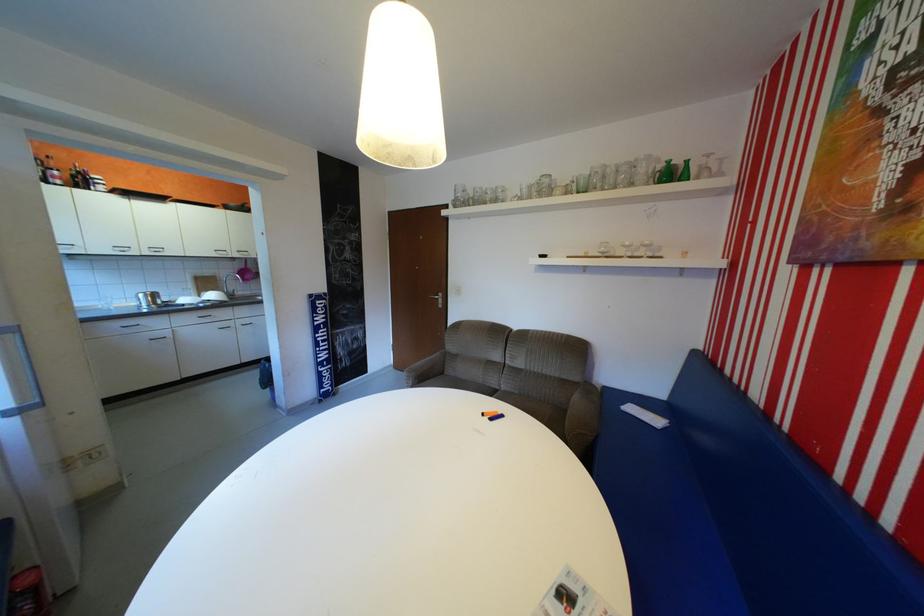
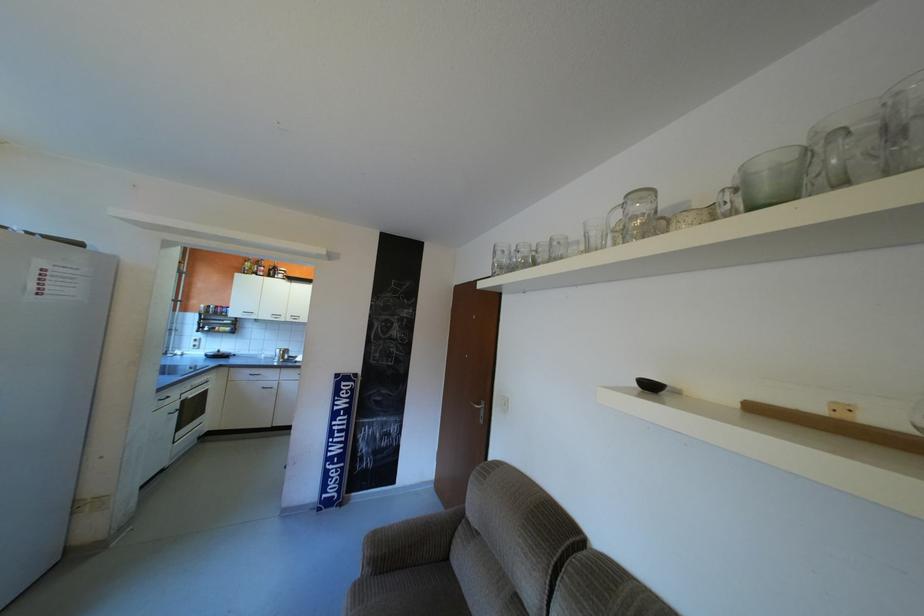
Where in the second image is the point corresponding to [331,338] from the first image?

(346, 427)